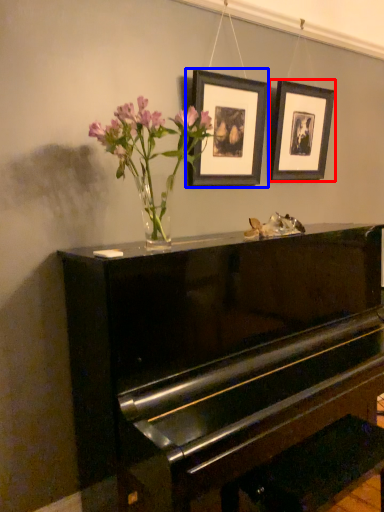
Question: Which of the following is the farthest to the observer, picture frame (highlighted by a red box) or picture frame (highlighted by a blue box)?

Choices:
 (A) picture frame
 (B) picture frame

Answer: (A)